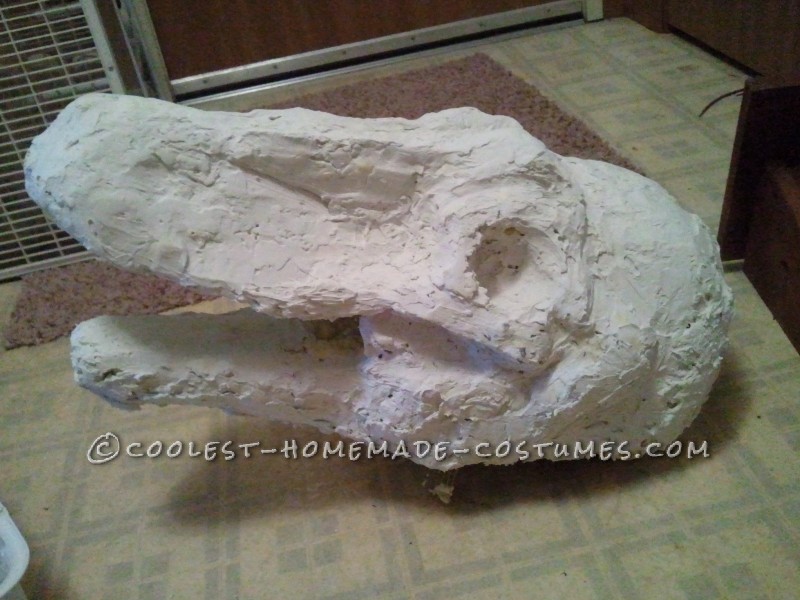
Where is `screws at bottom of door`? screws at bottom of door is located at coordinates (554, 10), (486, 29), (416, 39), (345, 50), (284, 67), (202, 77).